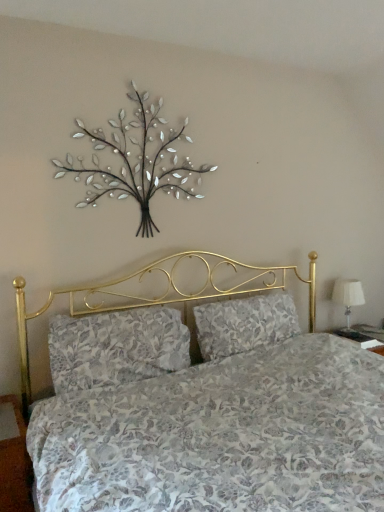
Question: Considering the positions of floral fabric pillow at center, which is the first pillow in left-to-right order, and floral fabric pillow at center, the second pillow from the left, in the image, is floral fabric pillow at center, which is the first pillow in left-to-right order, wider or thinner than floral fabric pillow at center, the second pillow from the left,?

Choices:
 (A) thin
 (B) wide

Answer: (B)

Question: Considering the positions of floral fabric pillow at center, positioned as the 2th pillow in right-to-left order, and floral fabric pillow at center, which is the first pillow from right to left, in the image, is floral fabric pillow at center, positioned as the 2th pillow in right-to-left order, taller or shorter than floral fabric pillow at center, which is the first pillow from right to left,?

Choices:
 (A) short
 (B) tall

Answer: (B)

Question: Which is nearer to the metallic silver tree at upper center?

Choices:
 (A) white fabric lampshade at right
 (B) floral fabric pillow at center, the second pillow from the left
 (C) floral fabric pillow at center, positioned as the 2th pillow in right-to-left order

Answer: (C)

Question: Which object is positioned closest to the white fabric lampshade at right?

Choices:
 (A) floral fabric pillow at center, positioned as the 2th pillow in right-to-left order
 (B) floral fabric pillow at center, the second pillow from the left
 (C) metallic silver tree at upper center

Answer: (B)